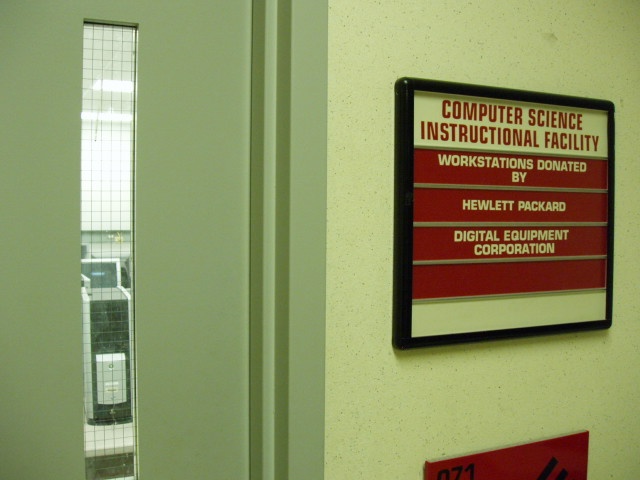
You are a GUI agent. You are given a task and a screenshot of the screen. Output one action in this format:
    pyautogui.click(x=<x>, y=<y>)
    Task: Click on the window
    
    Given the screenshot: What is the action you would take?
    pyautogui.click(x=125, y=270)